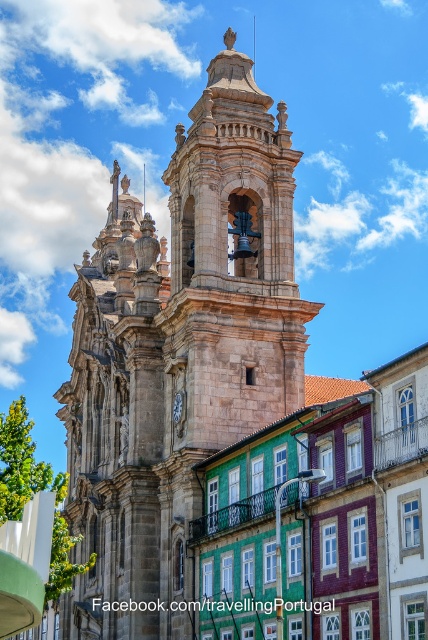
Question: Which of the following is the farthest from the observer?

Choices:
 (A) (181, 400)
 (B) (306, 337)

Answer: (B)

Question: Can you confirm if brown stone tower at center is positioned to the left of white wooden clock at center?

Choices:
 (A) no
 (B) yes

Answer: (B)

Question: Can you confirm if brown stone tower at center is positioned to the right of white wooden clock at center?

Choices:
 (A) yes
 (B) no

Answer: (B)

Question: Can you confirm if brown stone tower at center is positioned to the left of white wooden clock at center?

Choices:
 (A) yes
 (B) no

Answer: (A)

Question: Which of the following is the closest to the observer?

Choices:
 (A) white wooden clock at center
 (B) brown stone tower at center

Answer: (B)